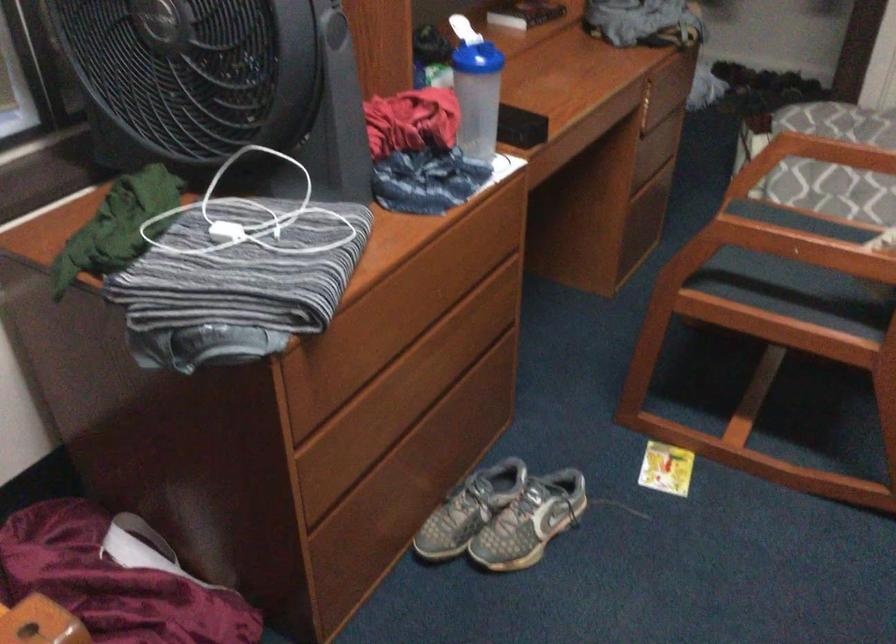
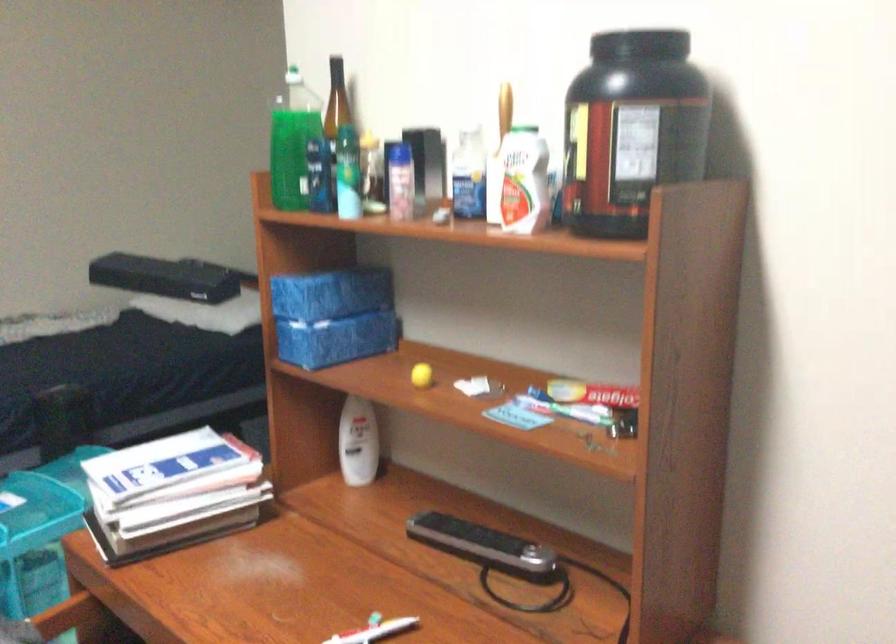
Question: How did the camera likely rotate?

Choices:
 (A) Left
 (B) Right
 (C) Up
 (D) Down

Answer: (B)